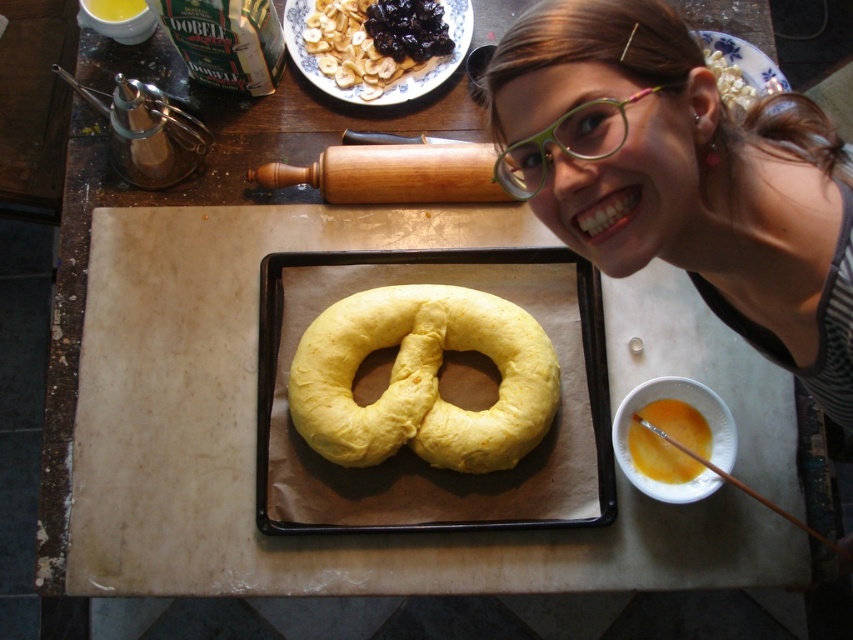
You are a baker preparing to decorate the pretzel dough. You have green plastic glasses at upper center and yellow matte egg yolk at center. Which item is above the other?

The green plastic glasses at upper center is positioned over yellow matte egg yolk at center.

You are a baker preparing to bake pretzels and see the green plastic glasses at upper center and the yellow matte egg yolk at center in your kitchen. Which object is shorter?

The green plastic glasses at upper center is not as tall as the yellow matte egg yolk at center, so the green plastic glasses at upper center is shorter.

You are a baker who needs to apply the egg yolk to the pretzel. Given that the distance between the matte yellow pretzel at center and the yellow matte egg yolk at center is 12.59 inches, can you reach the egg yolk from the pretzel without moving either object? Please consider the typical arm length of a person.

The distance between the matte yellow pretzel at center and the yellow matte egg yolk at center is 12.59 inches. The average human arm length is about 28 inches, so yes, a baker can easily reach the yellow matte egg yolk at center from the matte yellow pretzel at center without moving either object.